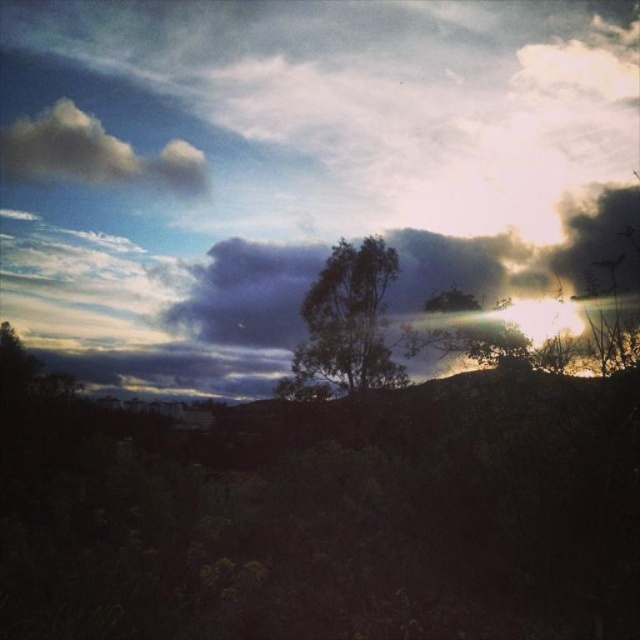
You are standing in the landscape scene and want to take a photo of the dark gray cloud at upper center and the green leafy tree at center. If your camera can focus on objects within 25 feet, will both objects be in focus?

The dark gray cloud at upper center is 24.50 feet away from the green leafy tree at center. Since the distance between them is within the camera focus range of 25 feet, both objects will be in focus.

You are standing in the landscape scene and want to walk from point A to point B. Point A is at coordinate point (352, 332) and point B is at coordinate point (141, 179). Which point is closer to you as you start your journey?

Point A at (352, 332) is closer to you than point B at (141, 179), so you will start at the closer point A.

You are standing in the landscape scene and want to estimate how far the dark gray cloud at upper center is from you. Based on the scene description, can you determine the distance?

The dark gray cloud at upper center is 90.03 feet away from the viewer.